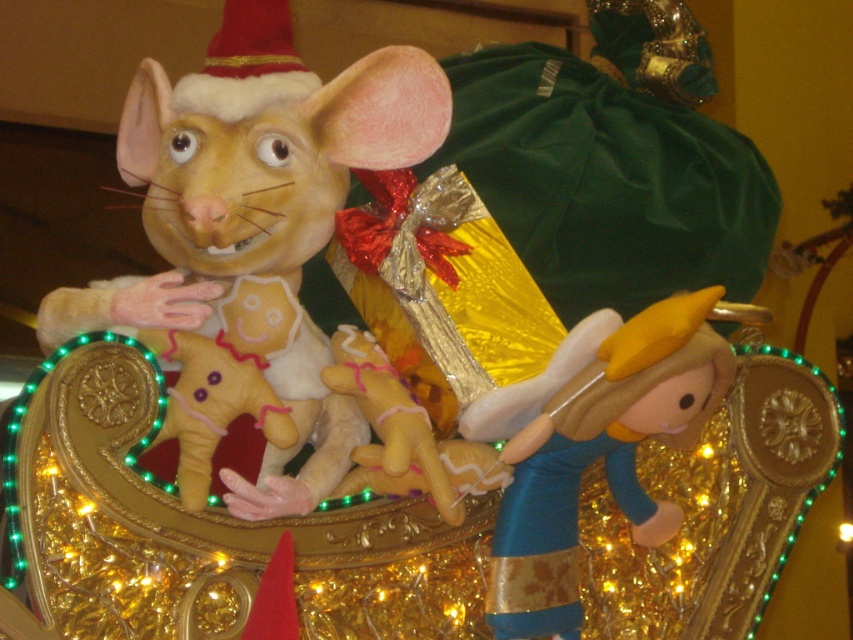
You are a child trying to reach for the gifts. Which object is taller, the matte yellow plush mouse at center or the velvet blue plush at right?

The matte yellow plush mouse at center is taller than the velvet blue plush at right.

Consider the image. In the festive scene, where is the matte yellow plush mouse at center relative to the soft plush gingerbread man at center?

The matte yellow plush mouse at center is to the right of the soft plush gingerbread man at center.